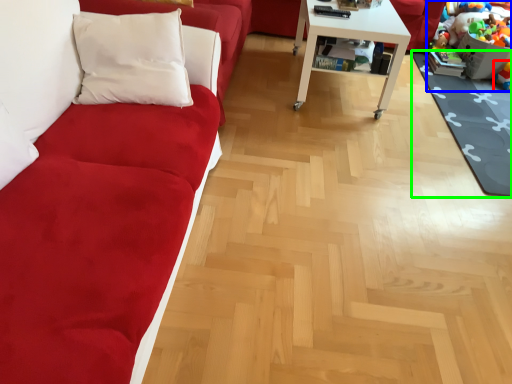
Question: Which object is the closest to the toy (highlighted by a red box)? Choose among these: toy (highlighted by a blue box) or mat (highlighted by a green box).

Choices:
 (A) toy
 (B) mat

Answer: (A)